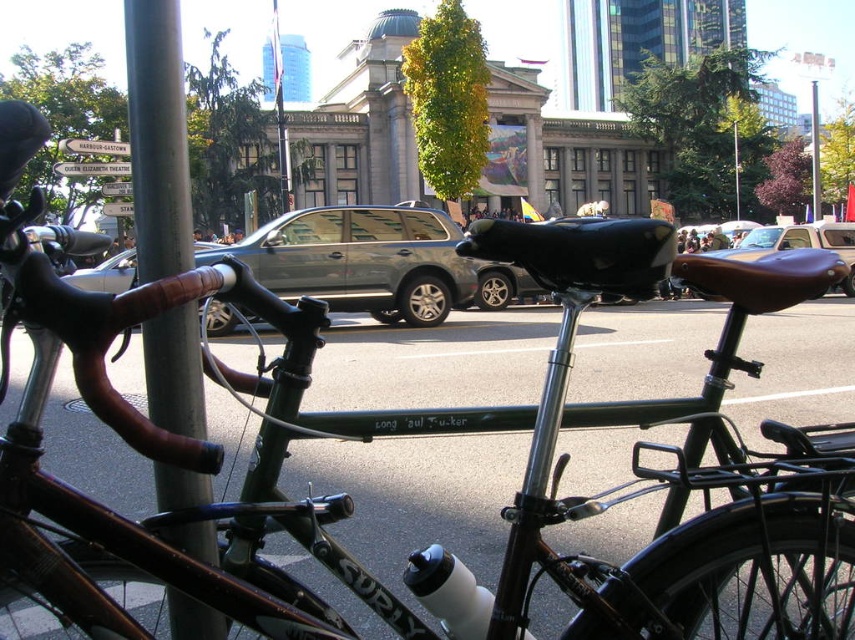
You are a delivery person who needs to place a package on a surface. You see the silver metallic pole at left and the brown leather seat at center. Which object can you place the package on?

The brown leather seat at center is a suitable surface for placing the package, while the silver metallic pole at left is a vertical structure and not appropriate for placing items.

You are a delivery person who needs to secure a package on the silver metallic pole at left and the brown leather seat at center. Which object will require a shorter package holder due to its height?

The silver metallic pole at left has a lesser height compared to the brown leather seat at center, so the package holder for the silver metallic pole at left needs to be shorter.

You are a delivery person who needs to park your 2.5 meters wide van between the metallic gray suv at center and the brown leather seat at center. Is there enough space between them for your van?

The metallic gray suv at center has a lesser width compared to brown leather seat at center, but the description does not provide the exact distance between them. Therefore, it is impossible to determine if there is enough space for the van.